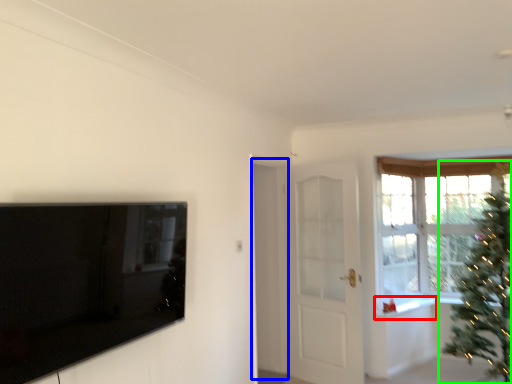
Question: Which object is the closest to the window sill (highlighted by a red box)? Choose among these: screen door (highlighted by a blue box) or christmas tree (highlighted by a green box).

Choices:
 (A) screen door
 (B) christmas tree

Answer: (B)